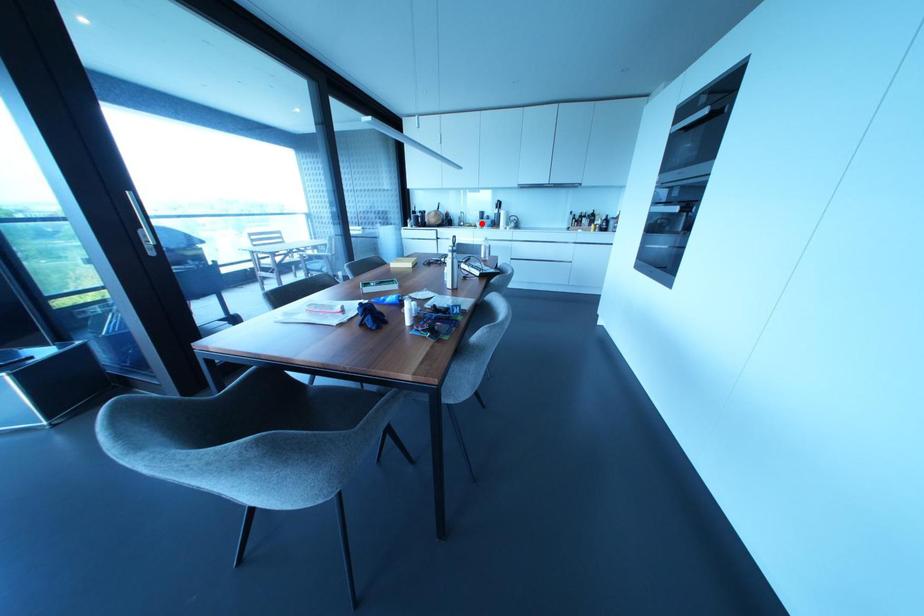
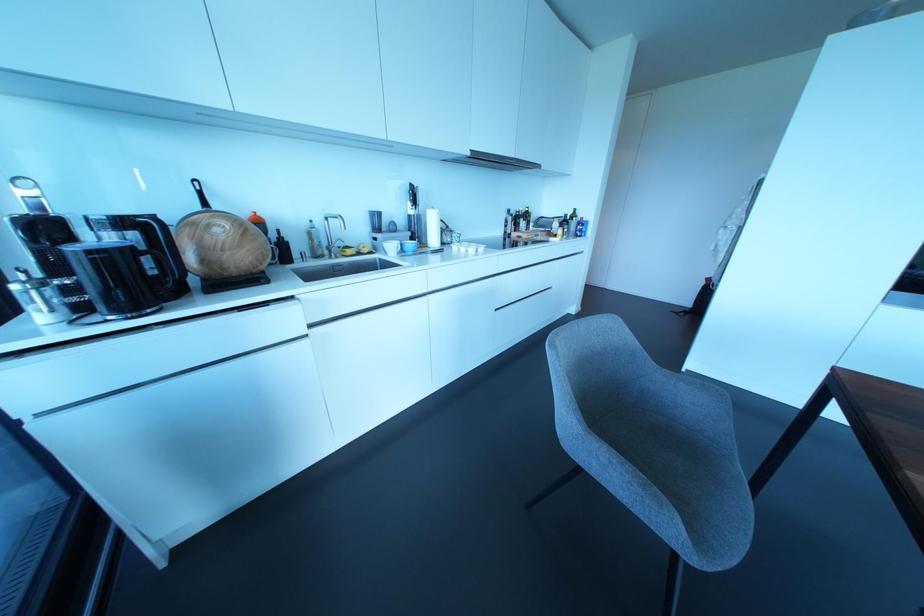
Question: I am providing you with two images of the same scene from different viewpoints. A red point is shown in image1. For the corresponding object point in image2, is it positioned nearer or farther from the camera?

Choices:
 (A) Nearer
 (B) Farther

Answer: (B)